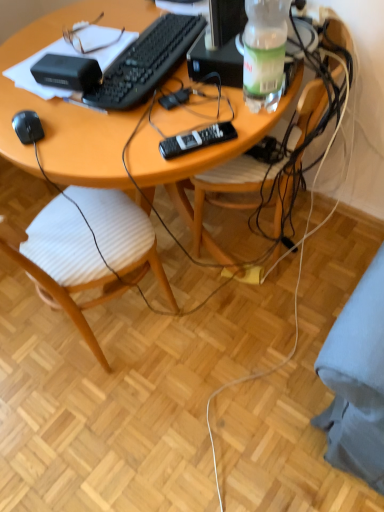
Locate an element on the screen. The image size is (384, 512). vacant space behind black matte computer mouse at lower left is located at coordinates (30, 103).